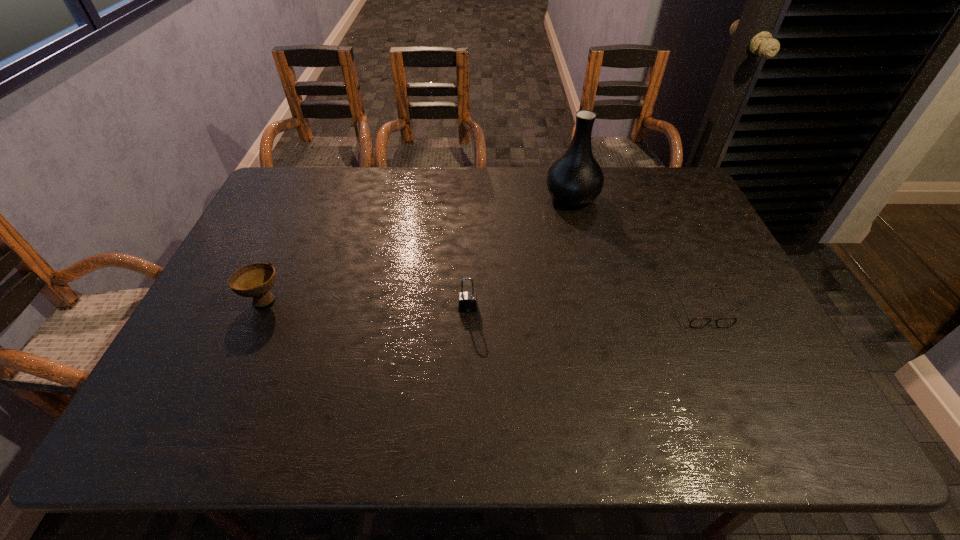
Find the location of a particular element. The image size is (960, 540). the closest object to the farthest object is located at coordinates (695, 322).

Where is `the second closest object relative to the second shortest object`? The width and height of the screenshot is (960, 540). the second closest object relative to the second shortest object is located at coordinates (575, 179).